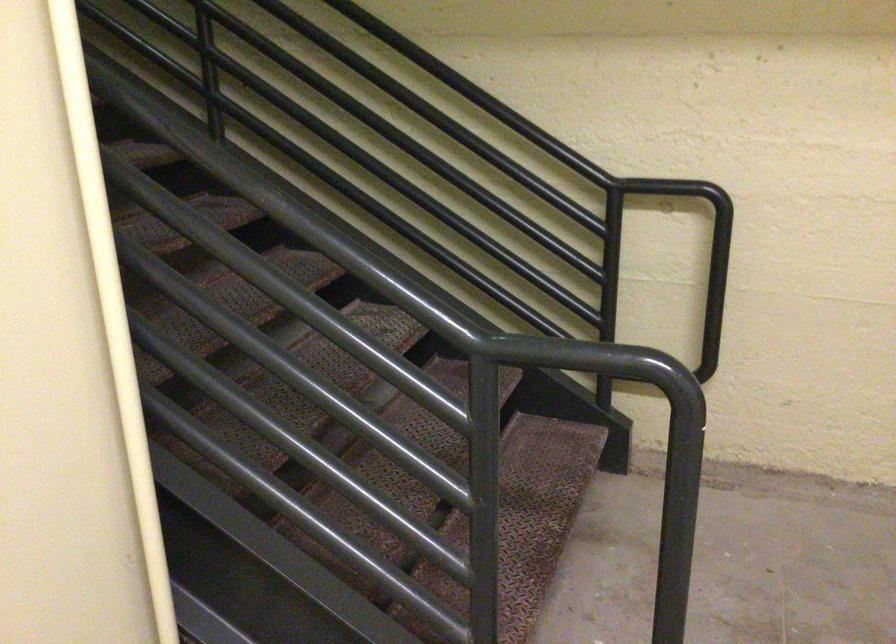
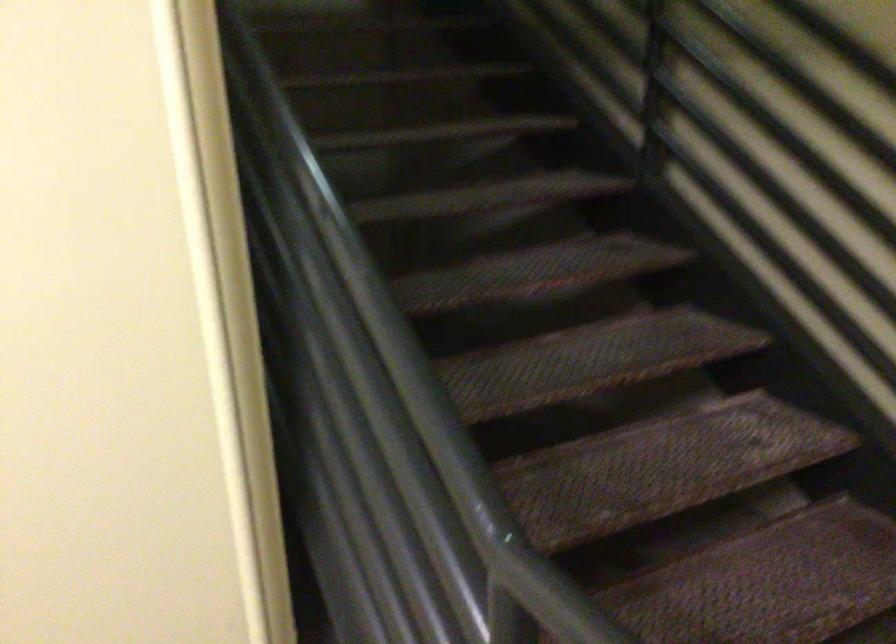
Question: The camera is either moving clockwise (left) or counter-clockwise (right) around the object. The first image is from the beginning of the video and the second image is from the end. Is the camera moving left or right when shooting the video?

Choices:
 (A) Left
 (B) Right

Answer: (B)